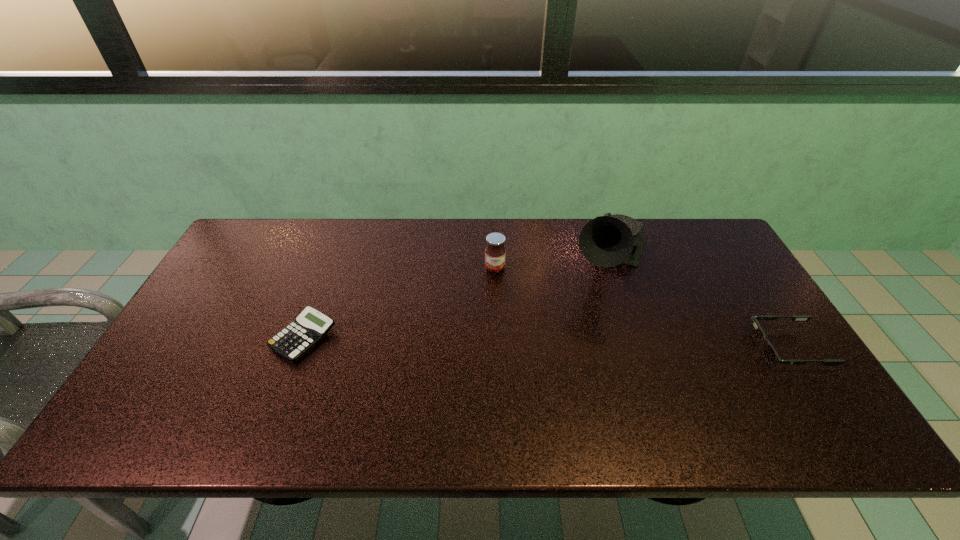
This screenshot has height=540, width=960. I want to click on vacant point that satisfies the following two spatial constraints: 1. on the front side of the shortest object; 2. on the temples of the second shortest object, so 300,348.

At what (x,y) coordinates should I click in order to perform the action: click on vacant region that satisfies the following two spatial constraints: 1. on the front side of the rightmost object; 2. on the temples of the third object from right to left. Please return your answer as a coordinate pair (x, y). This screenshot has height=540, width=960. Looking at the image, I should click on (498, 348).